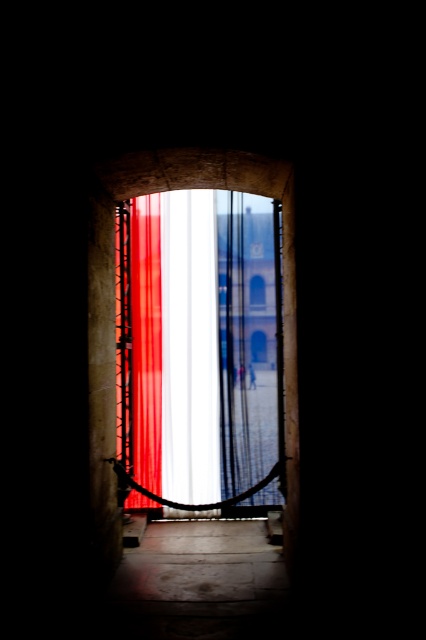
You are standing inside a historic building and want to exit through the arched doorway. To do so, you need to move the translucent fabric curtain at center out of the way. Based on its position, will moving it to the left or right side allow you to exit more easily?

The translucent fabric curtain at center is positioned at coordinates point (198, 352), which is slightly to the right of the center. Moving it to the left would create more space on the right side, making it easier to exit through the doorway.

You are standing inside a historic building and want to see the outdoor view through the arched doorway. There are two curtains blocking your view. Which curtain should you move to the left to get a clearer view of the outside? The curtains are the translucent fabric curtain at center and the smooth red curtain at center.

You should move the smooth red curtain at center to the left because the translucent fabric curtain at center is already to its right, so moving the smooth red one left would allow more visibility through the translucent one.